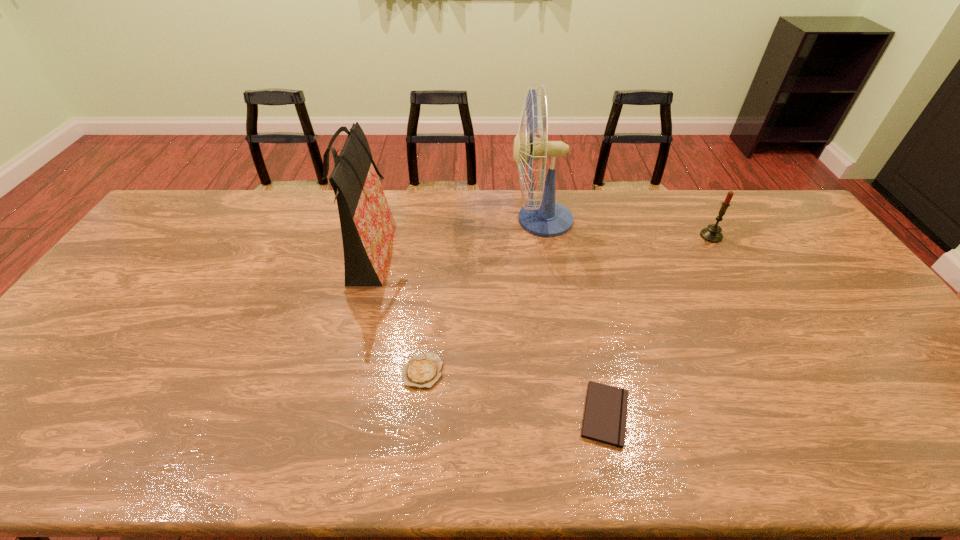
Find the location of a particular element. This screenshot has height=540, width=960. vacant region at the right edge of the desktop is located at coordinates (852, 291).

You are a GUI agent. You are given a task and a screenshot of the screen. Output one action in this format:
    pyautogui.click(x=<x>, y=<y>)
    Task: Click on the free space between the fan and the third tallest object
    The image size is (960, 540).
    Given the screenshot: What is the action you would take?
    pyautogui.click(x=626, y=228)

Where is `vacant area between the fourth object from right to left and the candle`? The image size is (960, 540). vacant area between the fourth object from right to left and the candle is located at coordinates (566, 303).

Locate an element on the screen. The image size is (960, 540). empty location between the fan and the leftmost object is located at coordinates (455, 239).

You are a GUI agent. You are given a task and a screenshot of the screen. Output one action in this format:
    pyautogui.click(x=<x>, y=<y>)
    Task: Click on the unoccupied area between the checkbook and the quiche
    This screenshot has width=960, height=540.
    Given the screenshot: What is the action you would take?
    pyautogui.click(x=514, y=393)

I want to click on free area in between the fan and the second object from left to right, so click(x=482, y=295).

Locate an element on the screen. This screenshot has width=960, height=540. vacant area that lies between the checkbook and the fan is located at coordinates (573, 317).

At what (x,y) coordinates should I click in order to perform the action: click on empty location between the checkbook and the quiche. Please return your answer as a coordinate pair (x, y). This screenshot has height=540, width=960. Looking at the image, I should click on (514, 393).

Where is `free spot between the checkbook and the fourth object from right to left`? This screenshot has width=960, height=540. free spot between the checkbook and the fourth object from right to left is located at coordinates (514, 393).

This screenshot has height=540, width=960. In order to click on blank region between the checkbook and the quiche in this screenshot , I will do `click(514, 393)`.